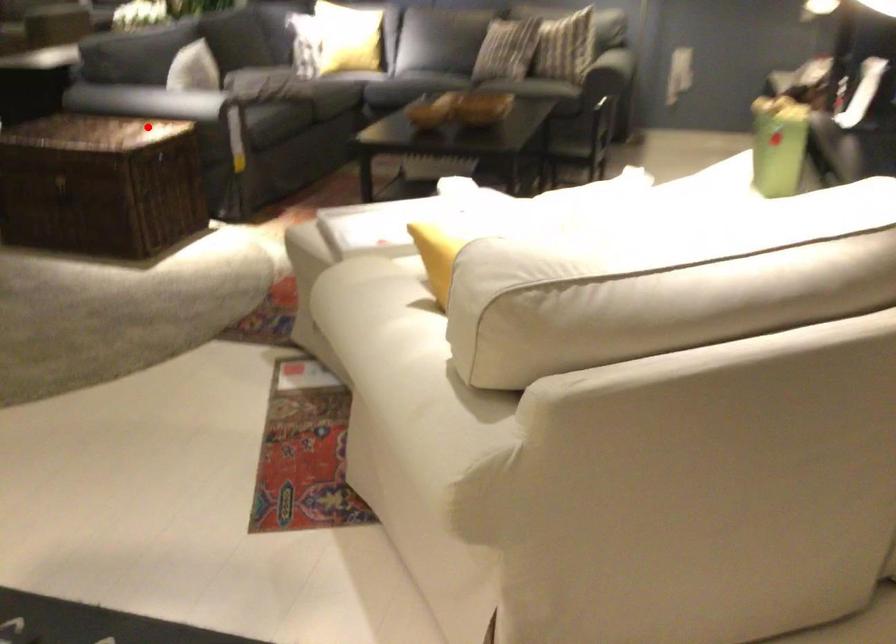
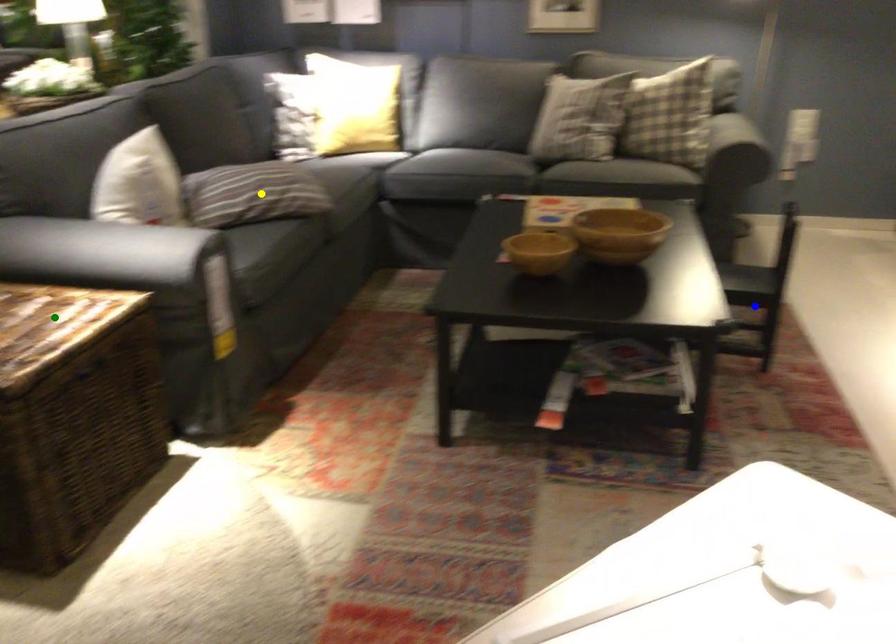
Question: I am providing you with two images of the same scene from different viewpoints. A red point is marked on the first image. You are given multiple points on the second image. Which point in image 2 is actually the same real-world point as the red point in image 1?

Choices:
 (A) green point
 (B) yellow point
 (C) blue point

Answer: (A)